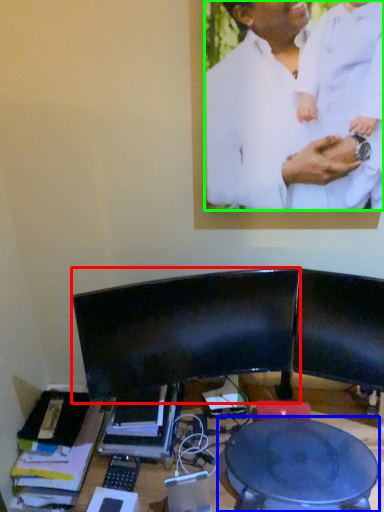
Question: Which object is the closest to the computer monitor (highlighted by a red box)? Choose among these: round table (highlighted by a blue box) or man (highlighted by a green box).

Choices:
 (A) round table
 (B) man

Answer: (A)